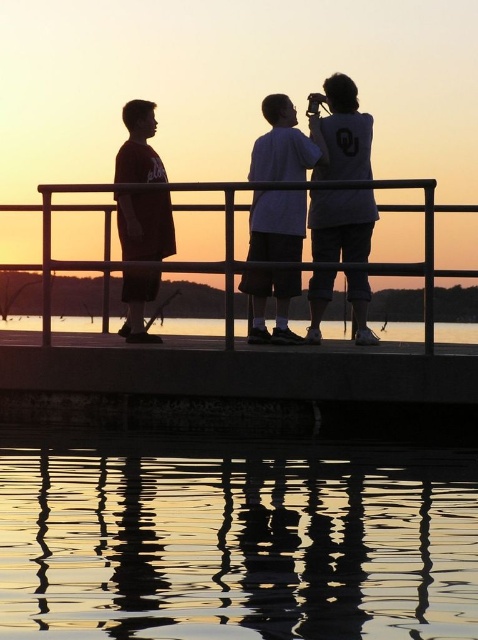
You are a photographer trying to capture the sunset scene. You notice a point at coordinates (340, 225) in the image. What object is located at that point?

The point at coordinates (340, 225) corresponds to the white matte shirt at upper center.

You are standing on the dock and want to take a photo of the sunset. You notice two types of water surfaces in front of you. Which one is positioned lower between the reflective water at lower center and the transparent glass water at lower center?

The reflective water at lower center is positioned lower than the transparent glass water at lower center.